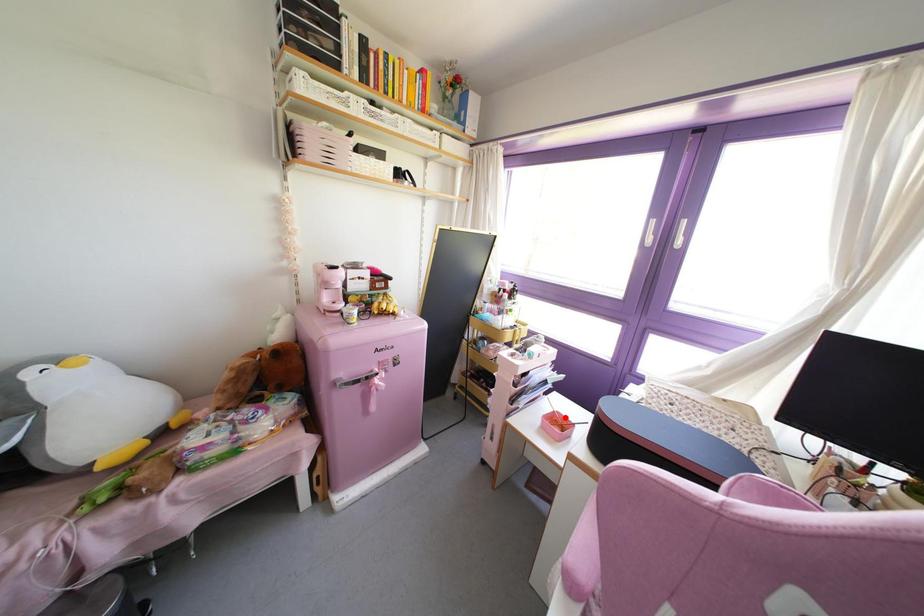
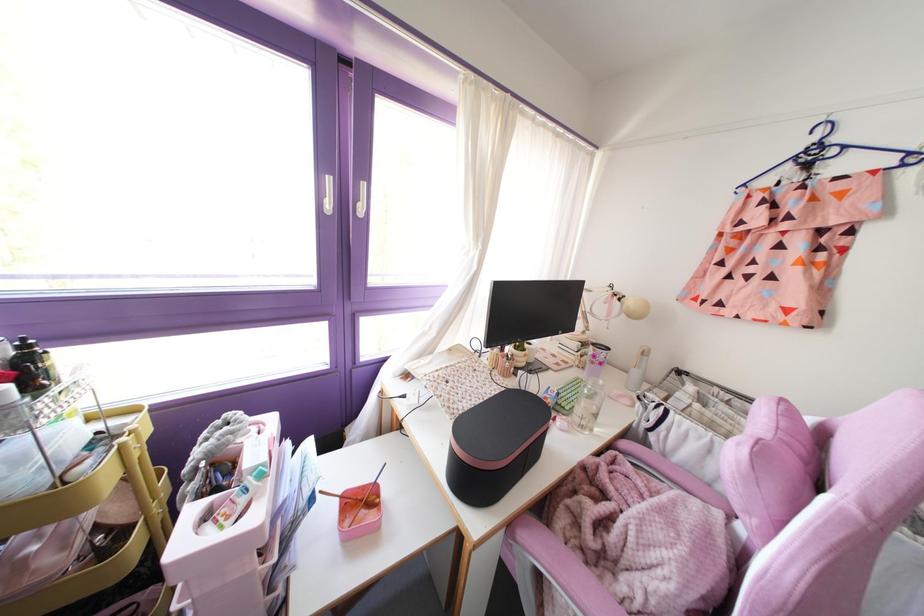
Where in the second image is the point corresponding to the highlighted location from the first image?

(359, 487)